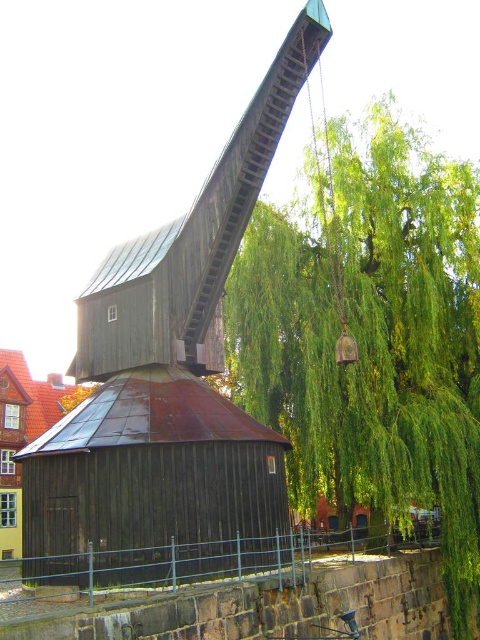
Is green leafy tree at center above wooden barn at center?

Yes, green leafy tree at center is above wooden barn at center.

What are the coordinates of `green leafy tree at center` in the screenshot? It's located at (373, 340).